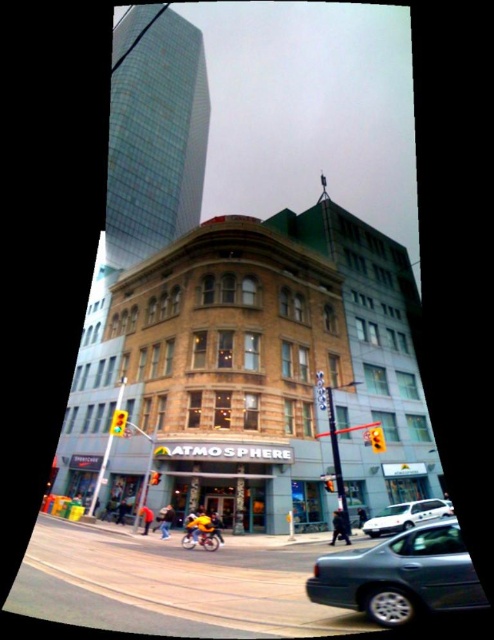
You are a delivery person who needs to park your van between the metallic gray sedan at lower right and the white matte car at lower right. Given that your van is 6 meters long, is there enough space between them?

The metallic gray sedan at lower right is larger in size than the white matte car at lower right, but the exact distance between them isn

You are a delivery person trying to park your 1.8 meters tall delivery cart between the metallic gray sedan at lower right and the white matte car at lower right. Can your cart fit vertically between them?

The metallic gray sedan at lower right is much taller than the white matte car at lower right, so the vertical space between them may not be sufficient for your 1.8 meters tall delivery cart. You should check the exact height difference to ensure clearance.